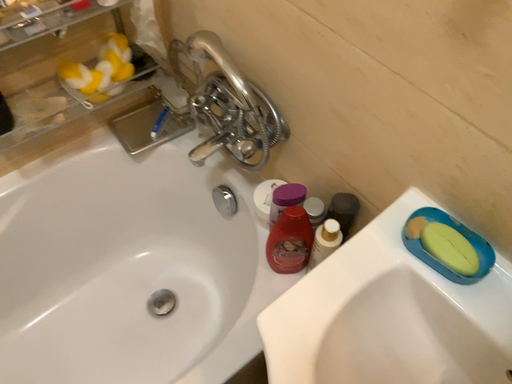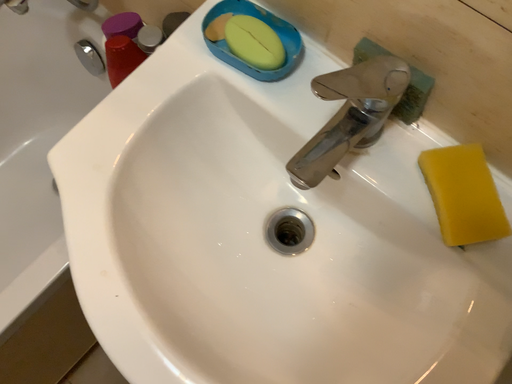
Question: How did the camera likely rotate when shooting the video?

Choices:
 (A) rotated upward
 (B) rotated downward

Answer: (B)